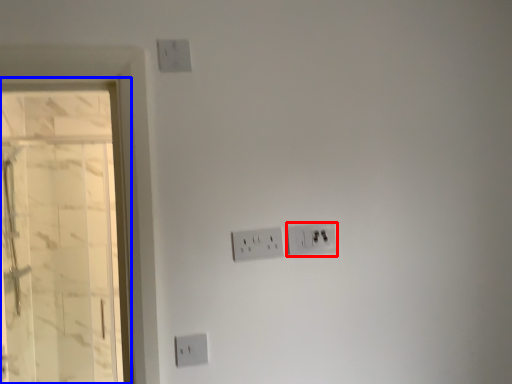
Question: Among these objects, which one is farthest to the camera, power plugs and sockets (highlighted by a red box) or glass door (highlighted by a blue box)?

Choices:
 (A) power plugs and sockets
 (B) glass door

Answer: (B)